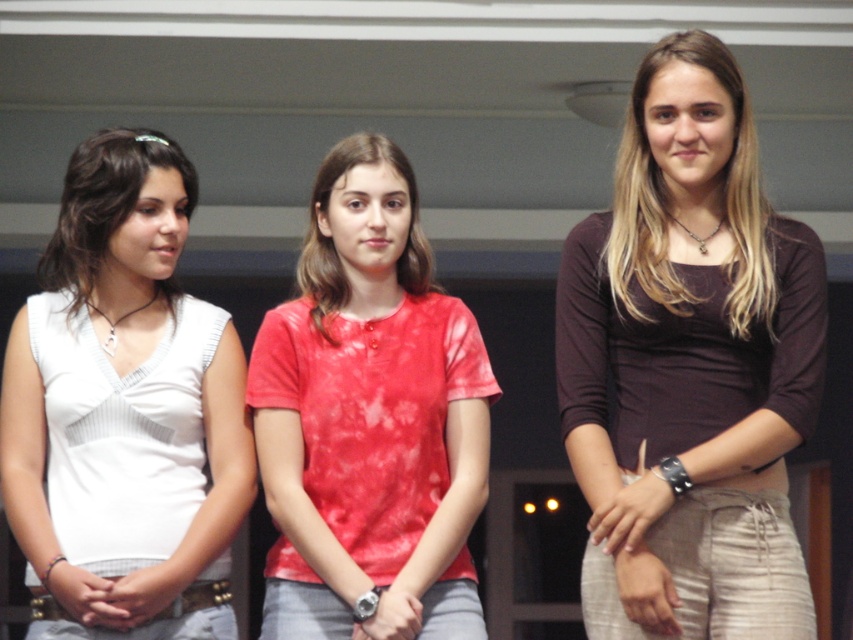
Question: Which object appears closest to the camera in this image?

Choices:
 (A) red tie-dye shirt at center
 (B) brown matte shirt at center

Answer: (B)

Question: Observing the image, what is the correct spatial positioning of brown matte shirt at center in reference to white matte tank top at left?

Choices:
 (A) above
 (B) below

Answer: (A)

Question: Can you confirm if red tie-dye t-shirt at center is positioned to the right of matte white blouse at left?

Choices:
 (A) yes
 (B) no

Answer: (A)

Question: Which object is the farthest from the red tie-dye t-shirt at center?

Choices:
 (A) brown matte shirt at center
 (B) matte white blouse at left
 (C) brown matte shirt at right
 (D) red tie-dye shirt at center

Answer: (C)

Question: Which of the following is the farthest from the observer?

Choices:
 (A) brown matte shirt at center
 (B) brown matte shirt at right
 (C) matte white blouse at left

Answer: (C)

Question: Can you confirm if brown matte shirt at right is wider than red tie-dye shirt at center?

Choices:
 (A) yes
 (B) no

Answer: (A)